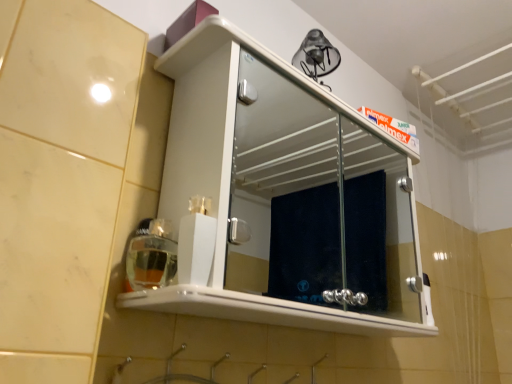
Question: From a real-world perspective, is translucent plastic soap dispenser at lower left above or below white glossy cabinet at upper center?

Choices:
 (A) below
 (B) above

Answer: (A)

Question: Is translucent plastic soap dispenser at lower left inside the boundaries of white glossy cabinet at upper center, or outside?

Choices:
 (A) outside
 (B) inside

Answer: (B)

Question: Considering the positions of translucent plastic soap dispenser at lower left and white glossy cabinet at upper center in the image, is translucent plastic soap dispenser at lower left taller or shorter than white glossy cabinet at upper center?

Choices:
 (A) tall
 (B) short

Answer: (B)

Question: In terms of width, does white glossy cabinet at upper center look wider or thinner when compared to translucent plastic soap dispenser at lower left?

Choices:
 (A) wide
 (B) thin

Answer: (A)

Question: Visually, is white glossy cabinet at upper center positioned to the left or to the right of translucent plastic soap dispenser at lower left?

Choices:
 (A) right
 (B) left

Answer: (A)

Question: Is white glossy cabinet at upper center bigger or smaller than translucent plastic soap dispenser at lower left?

Choices:
 (A) big
 (B) small

Answer: (A)

Question: Is white glossy cabinet at upper center taller or shorter than translucent plastic soap dispenser at lower left?

Choices:
 (A) tall
 (B) short

Answer: (A)